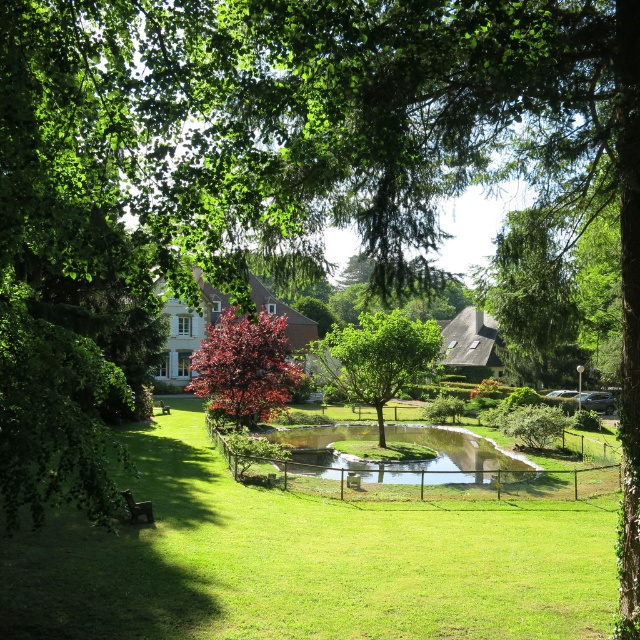
Question: Which object is farther from the camera taking this photo?

Choices:
 (A) shiny red tree at center
 (B) brown wooden park bench at lower left

Answer: (B)

Question: Which point appears farthest from the camera in this image?

Choices:
 (A) (362, 618)
 (B) (353, 429)
 (C) (218, 330)

Answer: (B)

Question: Where is shiny red tree at center located in relation to brown wooden park bench at lower left in the image?

Choices:
 (A) left
 (B) right

Answer: (B)

Question: Which point is closer to the camera taking this photo?

Choices:
 (A) (208, 394)
 (B) (362, 326)

Answer: (B)

Question: Can you confirm if green leafy tree at center is positioned to the left of brown wooden park bench at lower left?

Choices:
 (A) yes
 (B) no

Answer: (B)

Question: Is green grass at center bigger than green grassy pond at center?

Choices:
 (A) no
 (B) yes

Answer: (B)